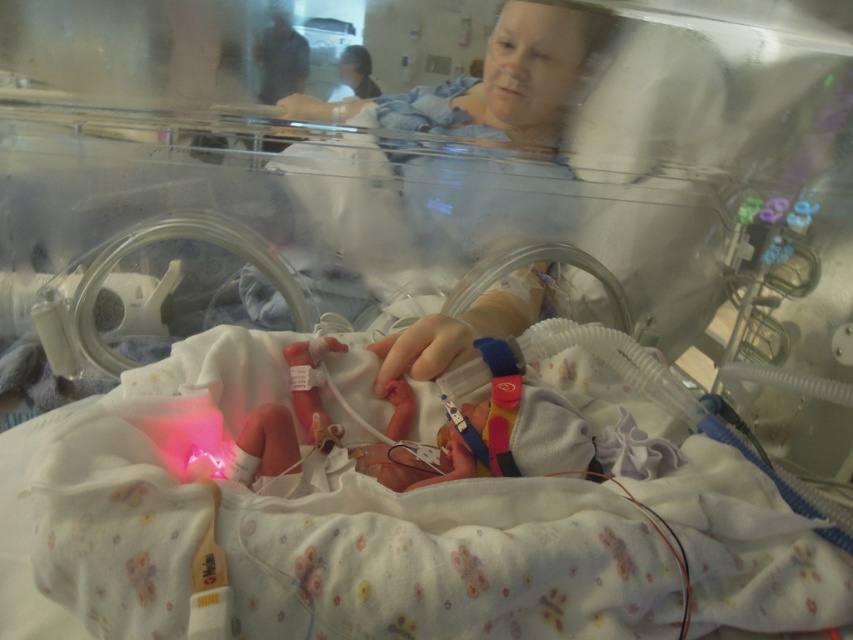
Question: Is smooth skin newborn at center closer to camera compared to blonde hair at upper center?

Choices:
 (A) yes
 (B) no

Answer: (A)

Question: Which is farther from the smooth skin newborn at center?

Choices:
 (A) matte blue gown at upper center
 (B) blonde hair at upper center

Answer: (B)

Question: Estimate the real-world distances between objects in this image. Which object is farther from the matte blue gown at upper center?

Choices:
 (A) blonde hair at upper center
 (B) smooth skin newborn at center

Answer: (B)

Question: Is smooth skin newborn at center above blonde hair at upper center?

Choices:
 (A) no
 (B) yes

Answer: (A)

Question: Can you confirm if matte blue gown at upper center is positioned to the right of blonde hair at upper center?

Choices:
 (A) yes
 (B) no

Answer: (A)

Question: Which object is the farthest from the blonde hair at upper center?

Choices:
 (A) matte blue gown at upper center
 (B) smooth skin newborn at center

Answer: (B)